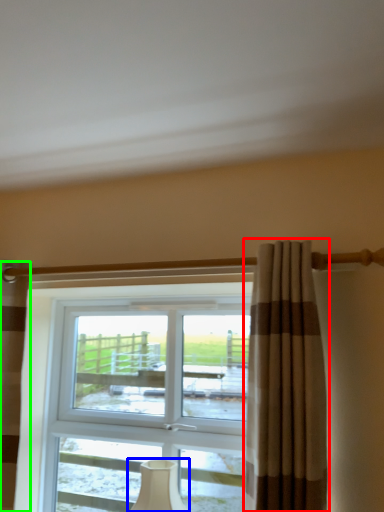
Question: Estimate the real-world distances between objects in this image. Which object is closer to curtain (highlighted by a red box), table lamp (highlighted by a blue box) or curtain (highlighted by a green box)?

Choices:
 (A) table lamp
 (B) curtain

Answer: (A)